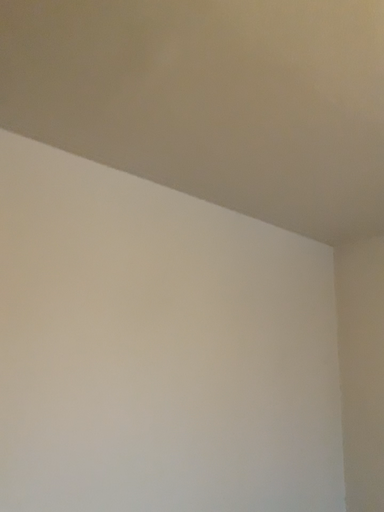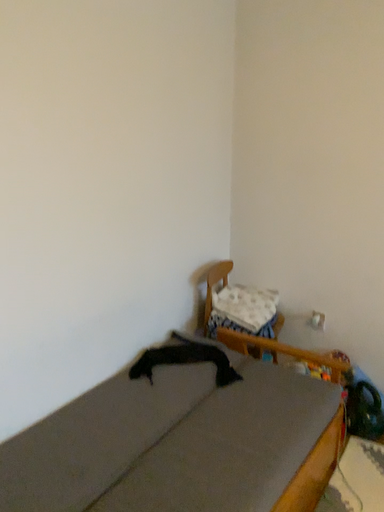
Question: Which way did the camera rotate in the video?

Choices:
 (A) rotated upward
 (B) rotated downward

Answer: (B)